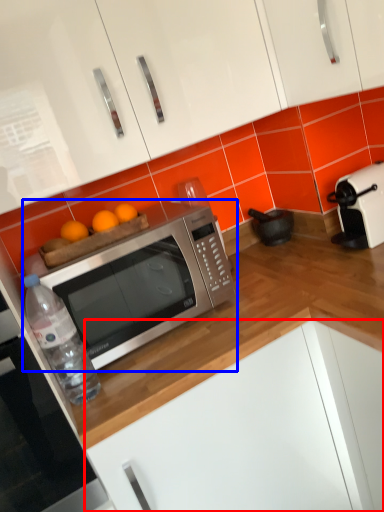
Question: Which of the following is the farthest to the observer, cabinetry (highlighted by a red box) or microwave oven (highlighted by a blue box)?

Choices:
 (A) cabinetry
 (B) microwave oven

Answer: (B)